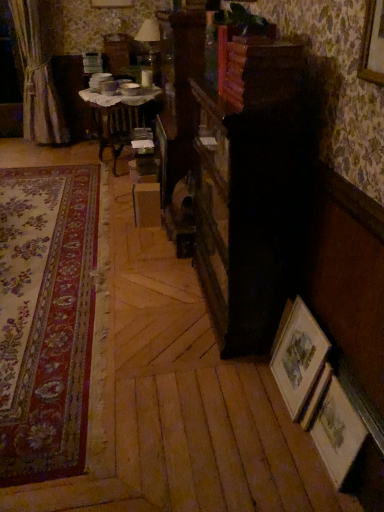
Question: Considering the positions of wooden table at center and wooden picture frame at lower right, marked as the 1th picture frame in a right-to-left arrangement, in the image, is wooden table at center wider or thinner than wooden picture frame at lower right, marked as the 1th picture frame in a right-to-left arrangement,?

Choices:
 (A) thin
 (B) wide

Answer: (B)

Question: From the image's perspective, is wooden table at center positioned above or below wooden picture frame at lower right, marked as the 1th picture frame in a right-to-left arrangement?

Choices:
 (A) below
 (B) above

Answer: (B)

Question: Estimate the real-world distances between objects in this image. Which object is farther from the matte white lampshade at upper center?

Choices:
 (A) wooden table at center
 (B) silky beige curtain at left
 (C) wooden picture frame at lower right, which is the 2th picture frame in left-to-right order
 (D) floral carpet at left
 (E) wooden framed print at lower right, which appears as the 1th picture frame when viewed from the left

Answer: (C)

Question: Which object is positioned farthest from the wooden at upper center?

Choices:
 (A) wooden framed print at lower right, which appears as the 2th picture frame when viewed from the right
 (B) wooden table at center
 (C) matte white lampshade at upper center
 (D) floral carpet at left
 (E) silky beige curtain at left

Answer: (E)